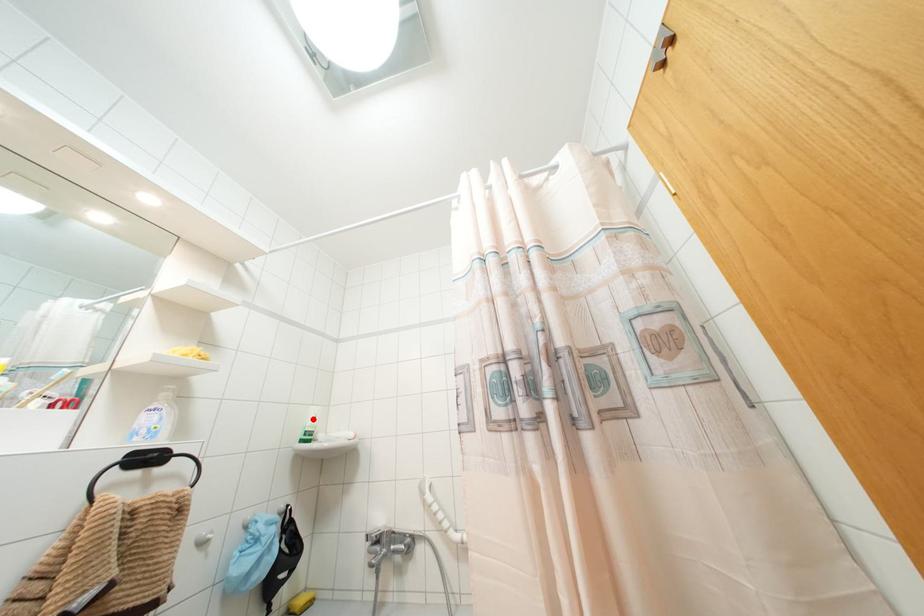
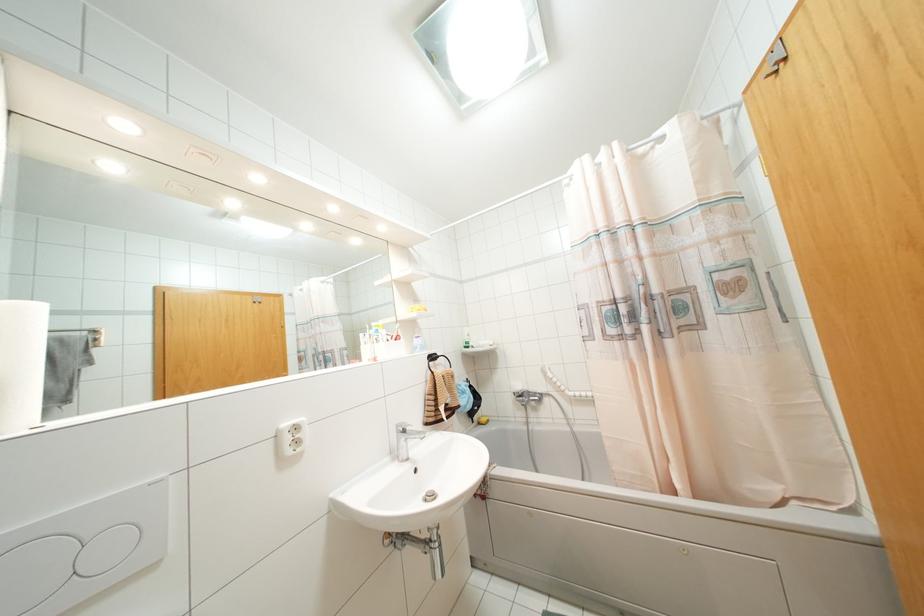
Where in the second image is the point corresponding to the highlighted location from the first image?

(468, 334)